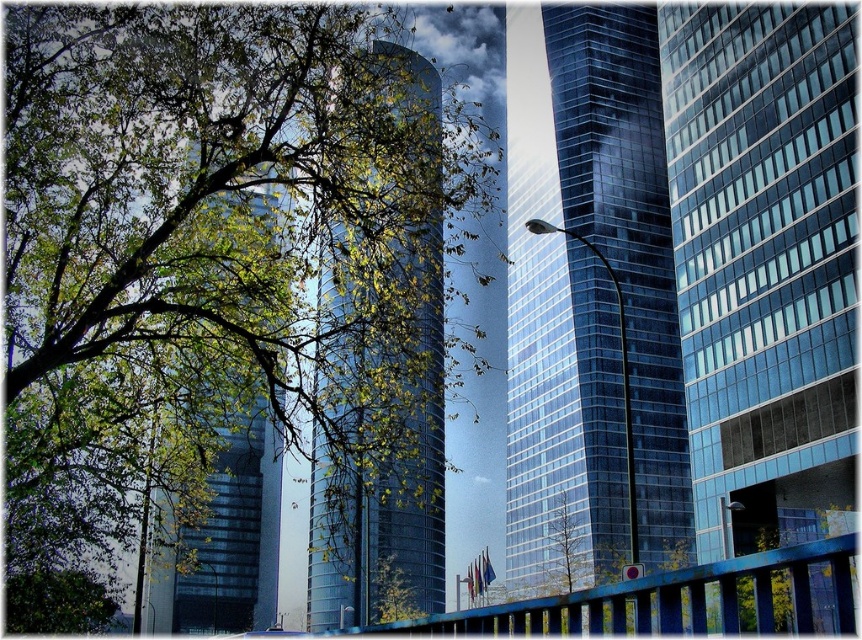
You are an architect analyzing the spatial relationships in this urban scene. You notice two points marked on the image at coordinates point (796, 260) and point (523, 536). Based on the scene description, which point is positioned closer to the viewer?

Point (796, 260) is closer to the viewer than point (523, 536) according to the description.

You are a city planner trying to install a new lamppost between the transparent glass skyscraper at center and the rectangular skyscraper on the right. The lamppost requires a minimum of 30 meters of space between the two buildings to be placed safely. Can you install the lamppost in this location?

The distance between the transparent glass skyscraper at center and the rectangular skyscraper on the right is 40.48 meters. Since the required minimum space is 30 meters, the lamppost can be safely installed between them.